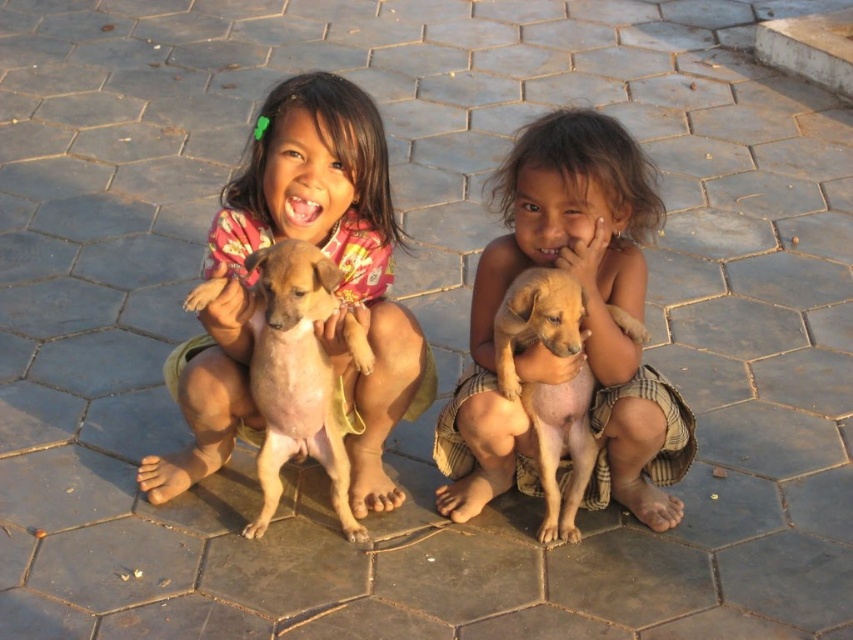
Does light brown fur puppy at center have a smaller size compared to light brown fur at center?

No, light brown fur puppy at center is not smaller than light brown fur at center.

Does light brown fur puppy at center lie in front of light brown fur at center?

No, it is not.

Where is `light brown fur puppy at center`? light brown fur puppy at center is located at coordinates (x=583, y=324).

The image size is (853, 640). Find the location of `light brown fur puppy at center`. light brown fur puppy at center is located at coordinates click(583, 324).

Which of these two, light brown fur puppy at center or matte pink shirt at center, stands taller?

matte pink shirt at center is taller.

Does light brown fur puppy at center have a lesser height compared to matte pink shirt at center?

Yes.

Where is `light brown fur puppy at center`? The image size is (853, 640). light brown fur puppy at center is located at coordinates (583, 324).

Find the location of a particular element. The height and width of the screenshot is (640, 853). light brown fur puppy at center is located at coordinates (583, 324).

Is point (380, 324) positioned before point (259, 380)?

That is False.

Is matte pink shirt at center below brown furry dog at center?

No.

This screenshot has height=640, width=853. I want to click on matte pink shirt at center, so 338,289.